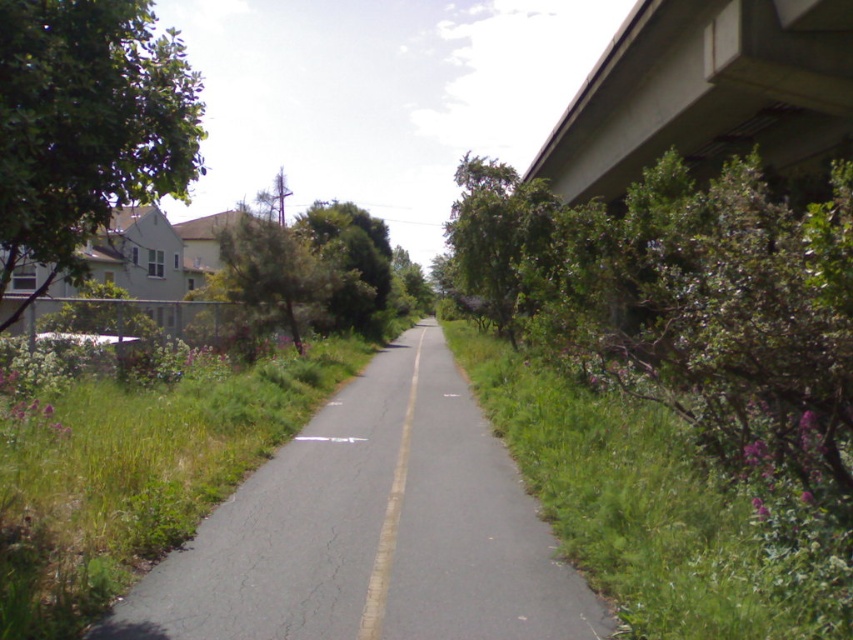
Question: Can you confirm if green leafy bush at right is positioned below green grass at right?

Choices:
 (A) yes
 (B) no

Answer: (B)

Question: Based on their relative distances, which object is farther from the green grass at right?

Choices:
 (A) green leafy tree at left
 (B) green grass at lower left
 (C) green leafy bush at right

Answer: (A)

Question: Among these objects, which one is nearest to the camera?

Choices:
 (A) green grass at right
 (B) green leafy tree at left
 (C) green leafy bush at right
 (D) green grass at lower left

Answer: (A)

Question: Is green leafy bush at right below green leafy tree at left?

Choices:
 (A) no
 (B) yes

Answer: (B)

Question: Which point appears farthest from the camera in this image?

Choices:
 (A) (813, 422)
 (B) (21, 17)

Answer: (A)

Question: Can you confirm if green grass at lower left is positioned below green grass at right?

Choices:
 (A) yes
 (B) no

Answer: (B)